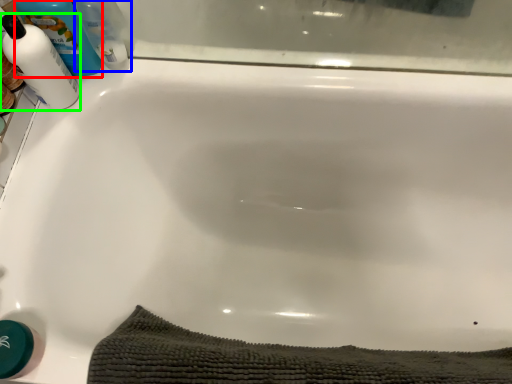
Question: Which is farther away from cleaning product (highlighted by a red box)? cleaning product (highlighted by a blue box) or cleaning product (highlighted by a green box)?

Choices:
 (A) cleaning product
 (B) cleaning product

Answer: (A)